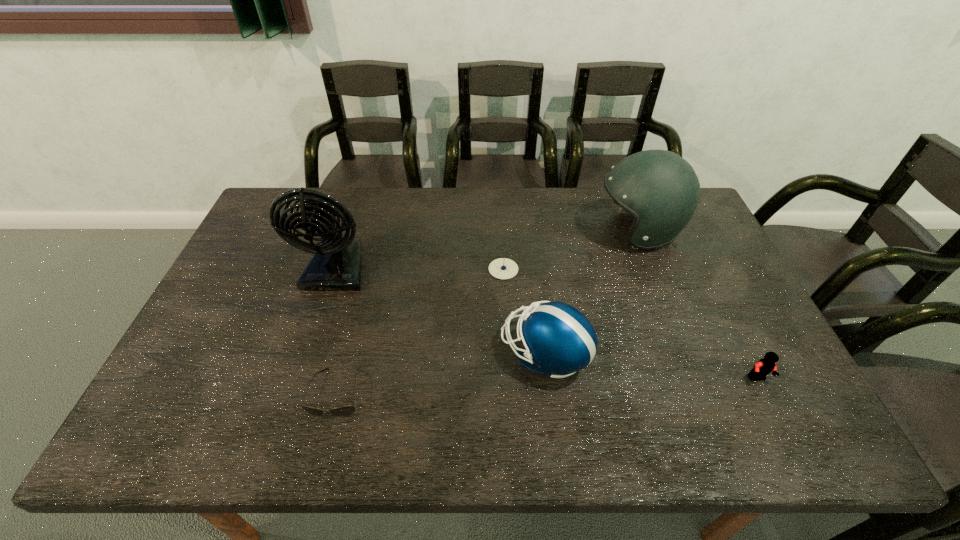
Identify the location of free point between the fan and the fourth shortest object. The height and width of the screenshot is (540, 960). (441, 310).

At what (x,y) coordinates should I click in order to perform the action: click on vacant space that is in between the third tallest object and the fourth tallest object. Please return your answer as a coordinate pair (x, y). This screenshot has height=540, width=960. Looking at the image, I should click on (651, 366).

Identify the location of unoccupied position between the taller football helmet and the sunglasses. (488, 312).

Where is `free space that is in between the sunglasses and the compass`? free space that is in between the sunglasses and the compass is located at coordinates (420, 331).

I want to click on blank region between the sunglasses and the fan, so click(x=337, y=330).

Identify the location of object that is the fifth closest to the farther football helmet. This screenshot has height=540, width=960. (343, 411).

What are the coordinates of `object that is the fifth closest to the farther football helmet` in the screenshot? It's located at (343, 411).

Locate an element on the screen. free space that satisfies the following two spatial constraints: 1. at the face opening of the farther football helmet; 2. on the front-facing side of the sunglasses is located at coordinates [x=700, y=393].

The width and height of the screenshot is (960, 540). I want to click on free spot that satisfies the following two spatial constraints: 1. at the face opening of the fifth shortest object; 2. on the front-facing side of the sunglasses, so click(x=700, y=393).